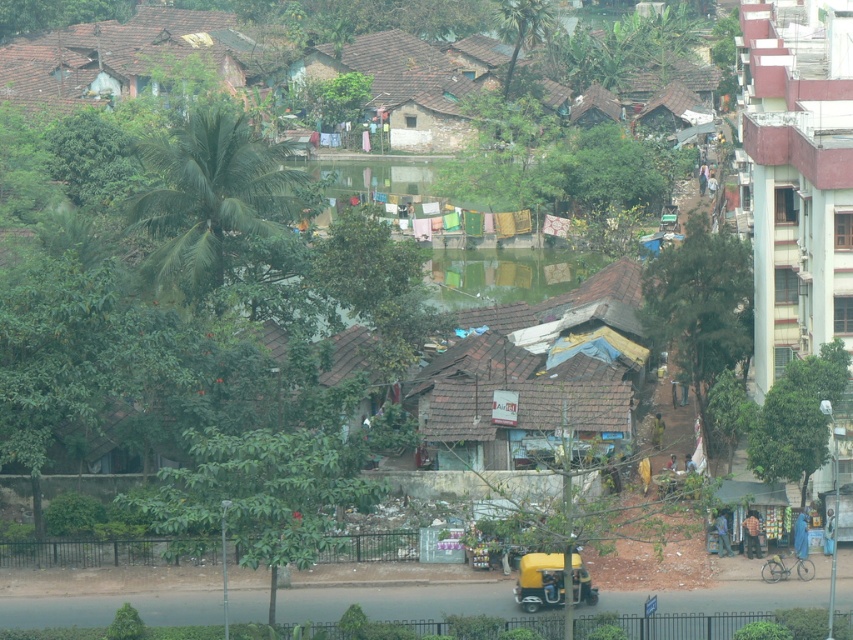
Question: Is green leafy tree at right smaller than green leafy tree at upper center?

Choices:
 (A) yes
 (B) no

Answer: (A)

Question: Is green leafy tree at center wider than green leafy tree at upper left?

Choices:
 (A) no
 (B) yes

Answer: (A)

Question: Which point is farther to the camera?

Choices:
 (A) (514, 8)
 (B) (828, 22)

Answer: (A)

Question: Among these objects, which one is nearest to the camera?

Choices:
 (A) green leafy tree at right
 (B) green leafy tree at center-right
 (C) brown tiled hut at upper left
 (D) light beige concrete building at upper right

Answer: (A)

Question: Which of these objects is positioned farthest from the brown tiled hut at upper left?

Choices:
 (A) green leafy tree at lower left
 (B) light beige concrete building at upper right
 (C) green leafy tree at left
 (D) green leafy tree at right

Answer: (A)

Question: Can you confirm if green leafy tree at lower left is positioned above yellow matte auto-rickshaw at lower center?

Choices:
 (A) yes
 (B) no

Answer: (A)